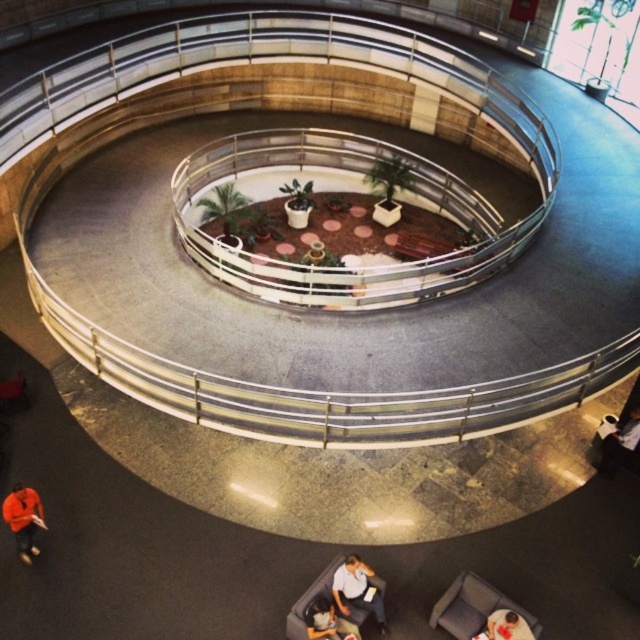
Question: Is velvet blue couch at lower right further to camera compared to white fabric shirt at lower center?

Choices:
 (A) no
 (B) yes

Answer: (A)

Question: Is white fabric shirt at lower center thinner than orange sweater at lower left?

Choices:
 (A) yes
 (B) no

Answer: (B)

Question: Which of these objects is positioned closest to the velvet blue couch at lower right?

Choices:
 (A) dark gray fabric jacket at lower right
 (B) orange sweater at lower left
 (C) white fabric shirt at lower center
 (D) smooth white shirt at lower center

Answer: (D)

Question: Is velvet blue couch at lower right wider than white fabric shirt at lower center?

Choices:
 (A) no
 (B) yes

Answer: (B)

Question: Which object appears closest to the camera in this image?

Choices:
 (A) orange sweater at lower left
 (B) white fabric shirt at lower center
 (C) dark gray fabric jacket at lower right

Answer: (B)

Question: Which object is positioned closest to the smooth white shirt at lower center?

Choices:
 (A) velvet blue couch at lower right
 (B) orange shirt at lower center
 (C) dark gray fabric jacket at lower right
 (D) white fabric shirt at lower center

Answer: (A)